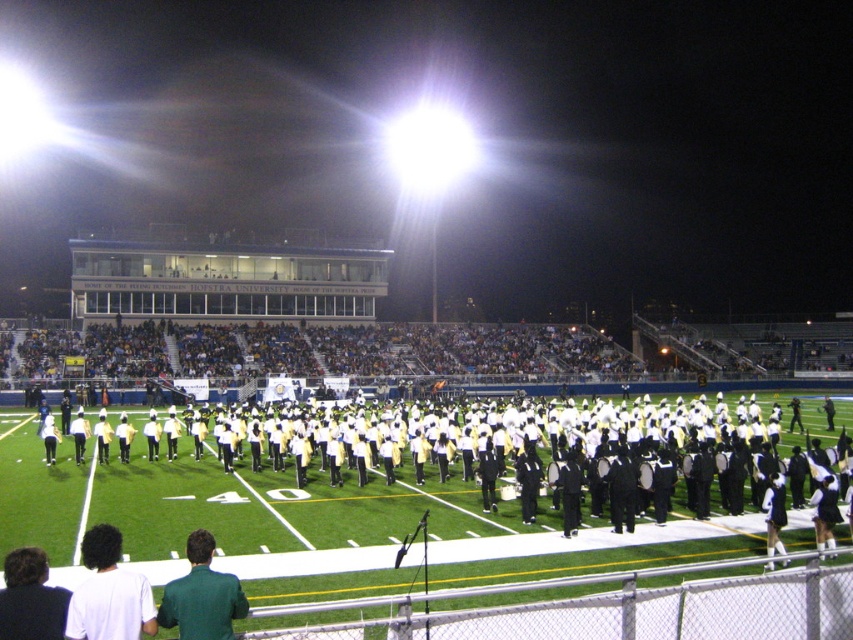
You are a photographer standing at the edge of the football field, and you want to take a picture of both the white matte shirt at lower left and the green matte shirt at lower center. Which shirt should you focus on first if you want to capture them both in the frame?

The white matte shirt at lower left is positioned on the left side of green matte shirt at lower center, so you should focus on the white matte shirt at lower left first to ensure both are in the frame.

You are a photographer at the football stadium and want to capture a photo of the white matte shirt at lower left and the green matte shirt at lower center. Which shirt will appear closer to the camera in the photo?

The white matte shirt at lower left will appear closer to the camera because it is in front of the green matte shirt at lower center.

You are a photographer at the stadium and want to capture a photo of both the white matte shirt at lower left and the green matte shirt at lower center in the same frame. Which shirt should you focus on first to ensure both are in the frame?

The white matte shirt at lower left has a smaller width than the green matte shirt at lower center. To ensure both are in the frame, focus on the green matte shirt at lower center first as it is wider, allowing the smaller white matte shirt at lower left to fit alongside within the camera frame.